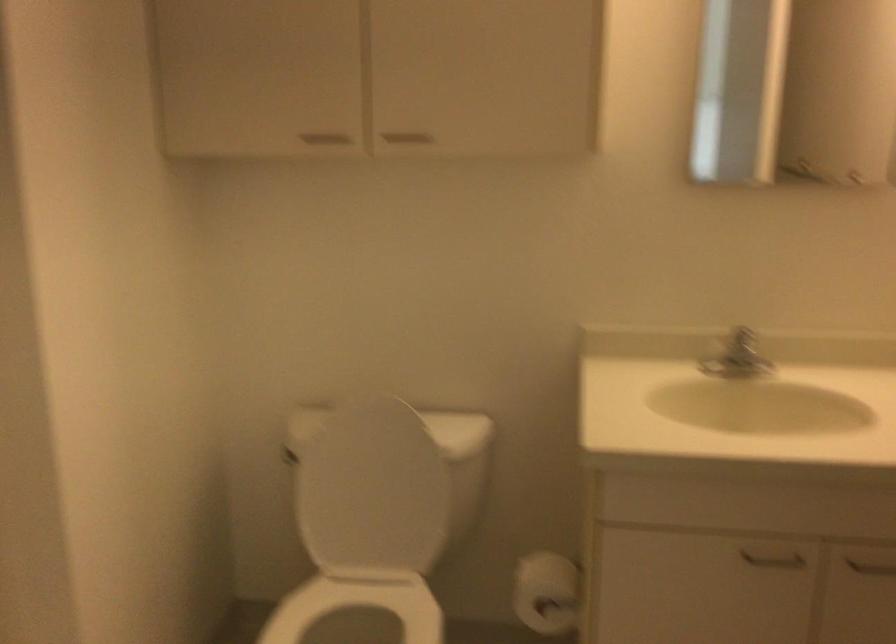
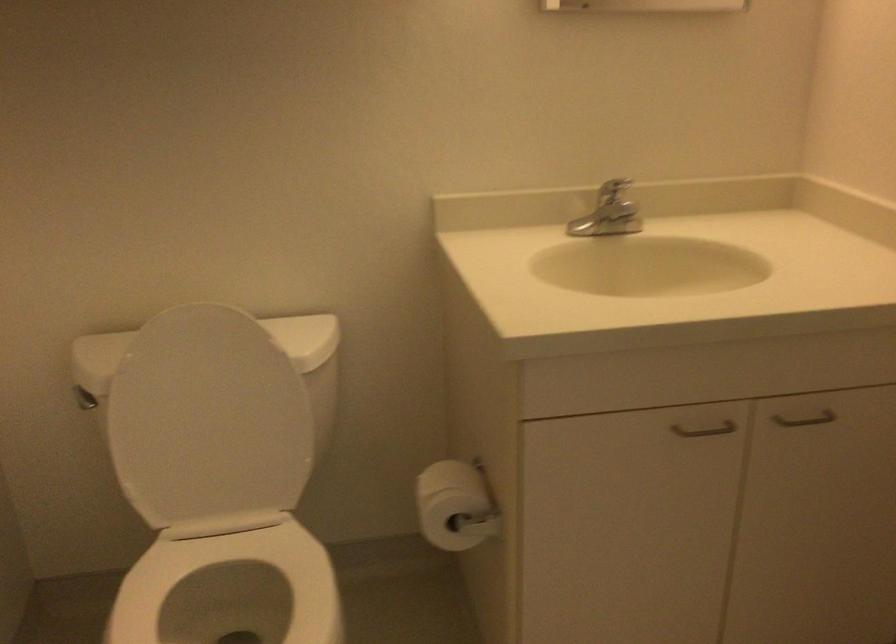
Question: How did the camera likely rotate?

Choices:
 (A) Left
 (B) Right
 (C) Up
 (D) Down

Answer: (B)